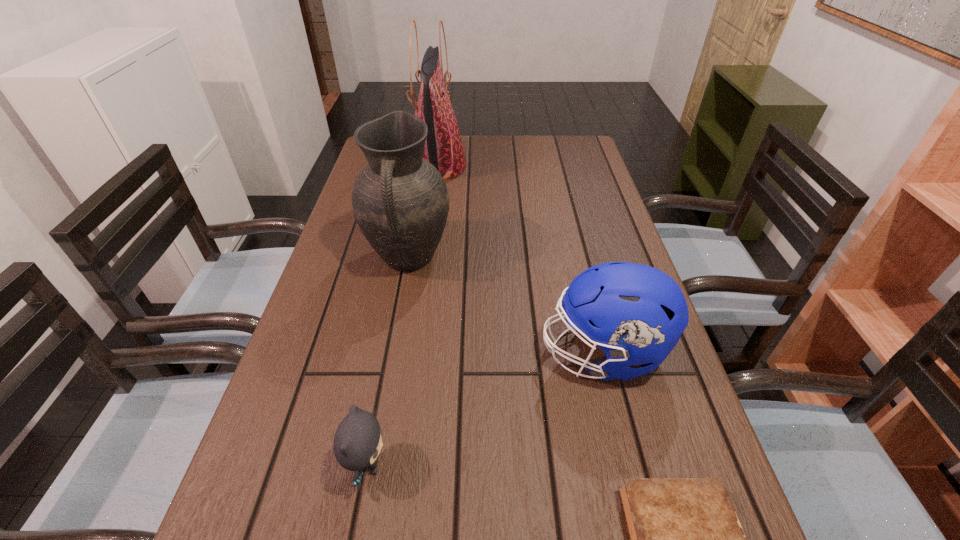
Where is `handbag`? This screenshot has height=540, width=960. handbag is located at coordinates (443, 148).

Image resolution: width=960 pixels, height=540 pixels. In order to click on the farthest object in this screenshot , I will do `click(443, 148)`.

I want to click on the second farthest object, so click(x=400, y=201).

Where is `pitcher`? pitcher is located at coordinates (400, 201).

Locate an element on the screen. This screenshot has width=960, height=540. the third tallest object is located at coordinates (636, 314).

The width and height of the screenshot is (960, 540). Find the location of `the third nearest object`. the third nearest object is located at coordinates (636, 314).

Locate an element on the screen. The image size is (960, 540). kitten is located at coordinates (357, 442).

Locate an element on the screen. free space located on the front of the farthest object is located at coordinates (423, 266).

Locate an element on the screen. This screenshot has width=960, height=540. free spot located 0.360m on the side of the fourth shortest object with the handle is located at coordinates (374, 447).

I want to click on free space located on the front-facing side of the third shortest object, so click(x=407, y=353).